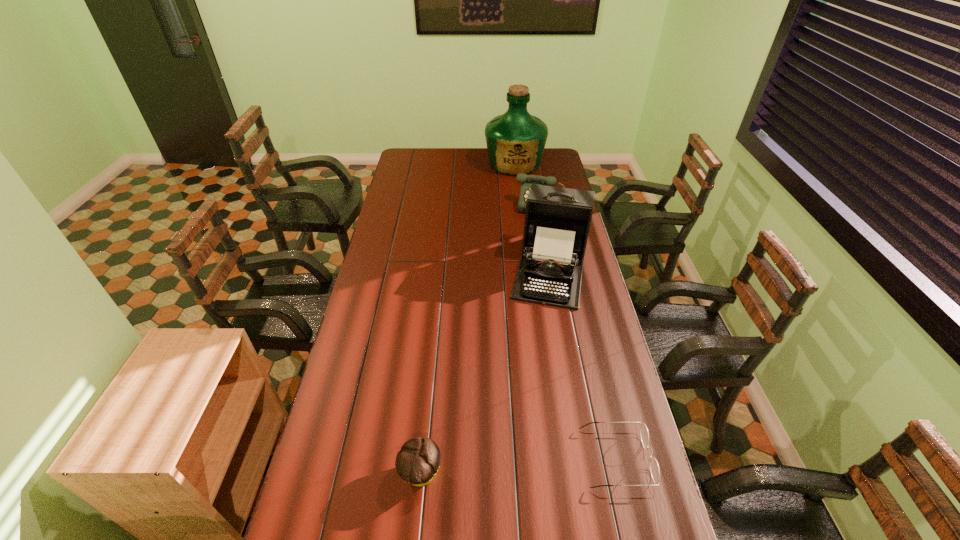
In order to click on vacant position in the image that satisfies the following two spatial constraints: 1. on the back side of the telephone; 2. on the right side of the muffin in this screenshot , I will do `click(447, 205)`.

You are a GUI agent. You are given a task and a screenshot of the screen. Output one action in this format:
    pyautogui.click(x=<x>, y=<y>)
    Task: Click on the free point that satisfies the following two spatial constraints: 1. on the front side of the tallest object; 2. on the right side of the third shortest object
    The width and height of the screenshot is (960, 540).
    Given the screenshot: What is the action you would take?
    pyautogui.click(x=519, y=205)

Where is `free space that satisfies the following two spatial constraints: 1. on the back side of the shortest object; 2. on the front-facing side of the fourth tallest object`? The image size is (960, 540). free space that satisfies the following two spatial constraints: 1. on the back side of the shortest object; 2. on the front-facing side of the fourth tallest object is located at coordinates point(422,458).

I want to click on blank area in the image that satisfies the following two spatial constraints: 1. on the front side of the spectacles; 2. on the front-facing side of the third nearest object, so click(584, 458).

The width and height of the screenshot is (960, 540). I want to click on vacant position in the image that satisfies the following two spatial constraints: 1. on the front side of the second farthest object; 2. on the front-facing side of the spectacles, so click(595, 458).

This screenshot has width=960, height=540. In order to click on vacant space that satisfies the following two spatial constraints: 1. on the back side of the shortest object; 2. on the front-facing side of the leftmost object in this screenshot , I will do `click(422, 458)`.